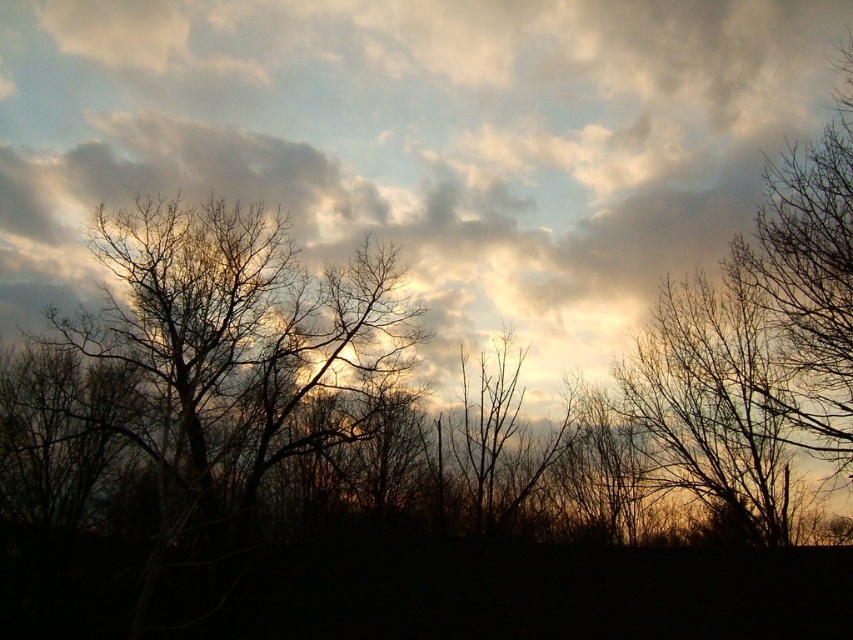
You are an astronomer analyzing the positions of celestial objects in the sky. You observe two points in the sky labeled as point (213,20) and point (848,289). According to the scene description, which point is closer to the observer?

Point (848,289) is closer to the observer because the description states that point (213,20) is behind point (848,289).

You are an artist sketching the scene and want to draw the brown textured tree at upper right and the brown textured tree at right accurately. Which tree should you draw first to ensure proper layering?

You should draw the brown textured tree at upper right first because the brown textured tree at right is behind it, so layering the upper right tree first will allow the background tree to be placed appropriately behind.

You are an artist trying to paint the scene. You need to decide the vertical positioning of the cloudy sky at upper center and the brown textured tree at right. Which one should you paint higher on your canvas?

The cloudy sky at upper center should be painted higher on the canvas because it is taller than the brown textured tree at right.